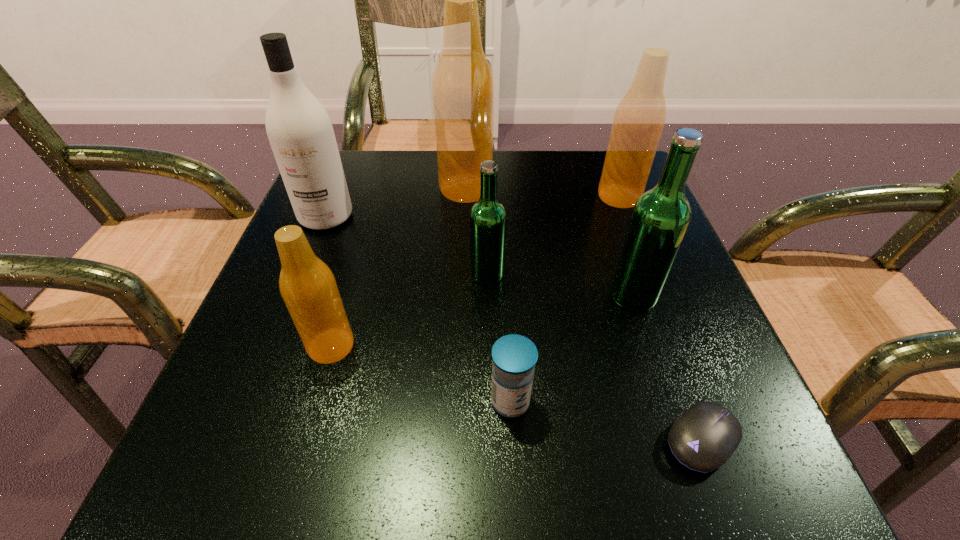
At what (x,y) coordinates should I click in order to perform the action: click on shampoo that is at the far edge. Please return your answer as a coordinate pair (x, y). The image size is (960, 540). Looking at the image, I should click on (300, 132).

The image size is (960, 540). I want to click on object situated at the near edge, so click(703, 438).

Where is `shampoo that is at the left edge`? The width and height of the screenshot is (960, 540). shampoo that is at the left edge is located at coordinates (300, 132).

What are the coordinates of `beer bottle present at the left edge` in the screenshot? It's located at (308, 287).

Image resolution: width=960 pixels, height=540 pixels. Identify the location of computer mouse that is at the right edge. (703, 438).

Image resolution: width=960 pixels, height=540 pixels. In order to click on object located at the far left corner in this screenshot , I will do `click(300, 132)`.

Locate an element on the screen. This screenshot has height=540, width=960. object at the far right corner is located at coordinates (639, 119).

Where is `object situated at the near right corner`? object situated at the near right corner is located at coordinates (703, 438).

In the image, there is a desktop. What are the coordinates of `vacant space at the far edge` in the screenshot? It's located at (501, 199).

Where is `free space at the near edge of the desktop`? The width and height of the screenshot is (960, 540). free space at the near edge of the desktop is located at coordinates (503, 462).